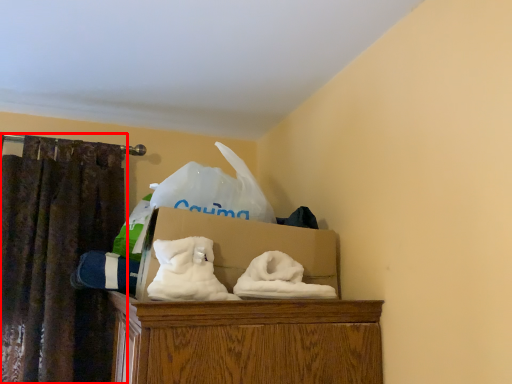
Question: From the image's perspective, where is curtain (annotated by the red box) located relative to box?

Choices:
 (A) below
 (B) above

Answer: (A)